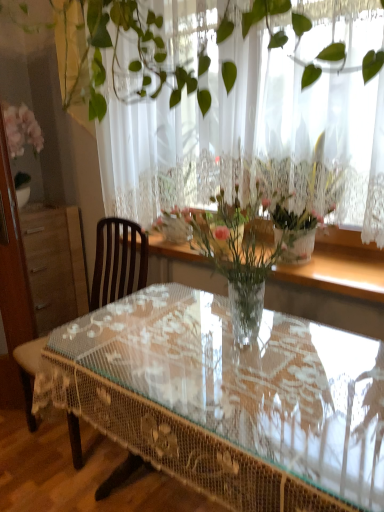
I want to click on free space on the front side of clear glass vase at center, so click(x=274, y=416).